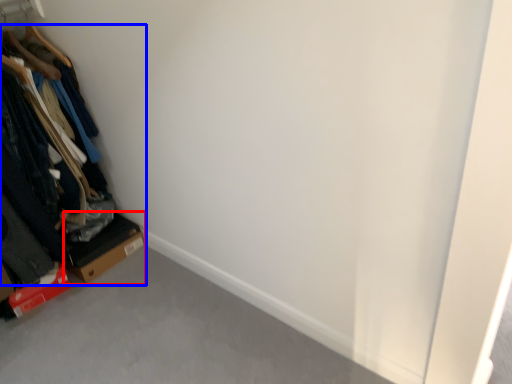
Question: Which of the following is the farthest to the observer, cardboard box (highlighted by a red box) or furniture (highlighted by a blue box)?

Choices:
 (A) cardboard box
 (B) furniture

Answer: (A)